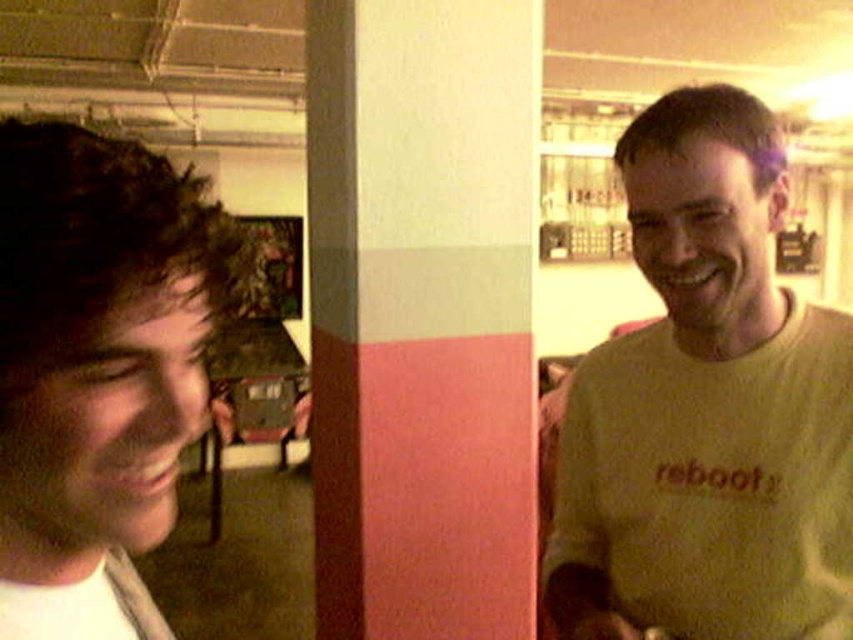
Is point (750, 428) positioned after point (184, 353)?

Yes, it is.

Between yellow cotton t-shirt at right and matte black hair at left, which one is positioned lower?

yellow cotton t-shirt at right is below.

Is point (788, 461) farther from camera compared to point (102, 394)?

Yes.

Identify the location of yellow cotton t-shirt at right. The width and height of the screenshot is (853, 640). (706, 410).